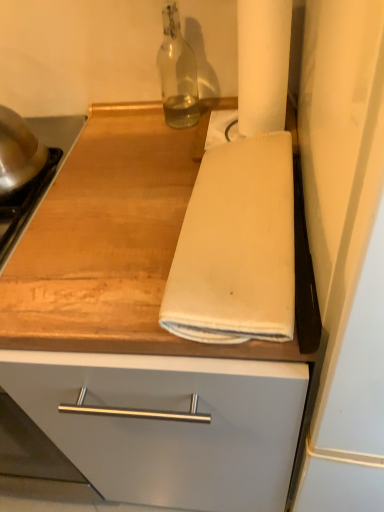
Identify the location of vacant space that is to the left of transparent glass bottle at upper center. (120, 130).